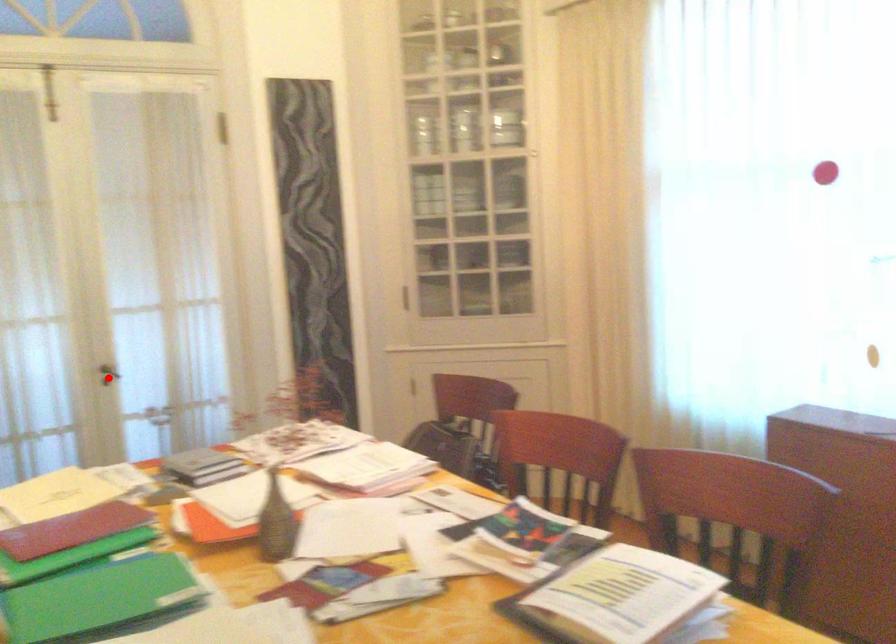
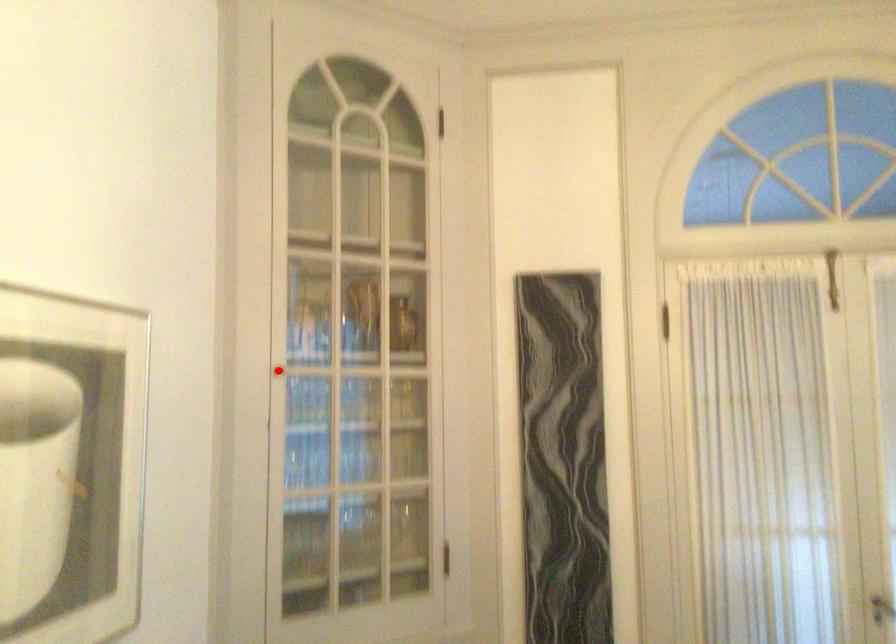
I am providing you with two images of the same scene from different viewpoints. A red point is marked on the first image and another point is marked on the second image. Does the point marked in image1 correspond to the same location as the one in image2?

No